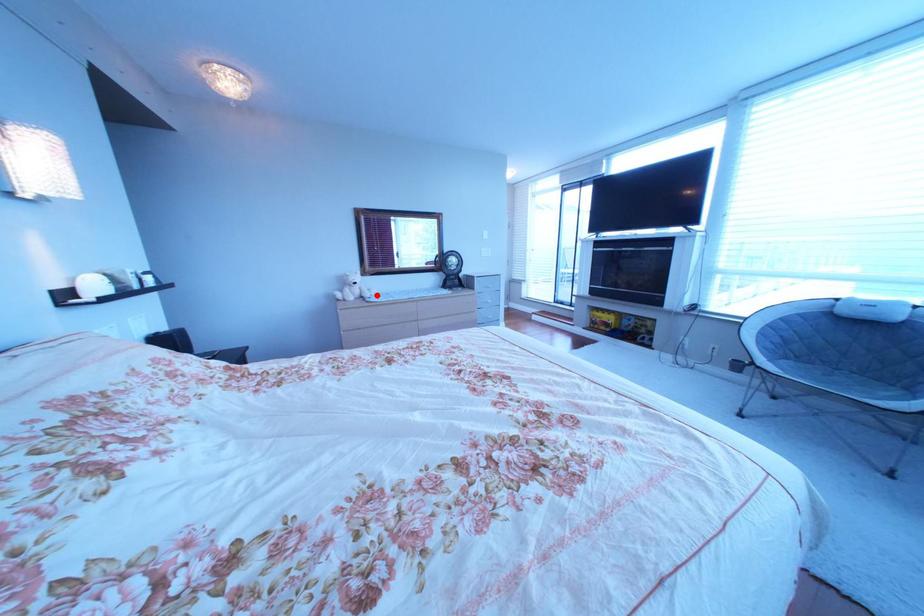
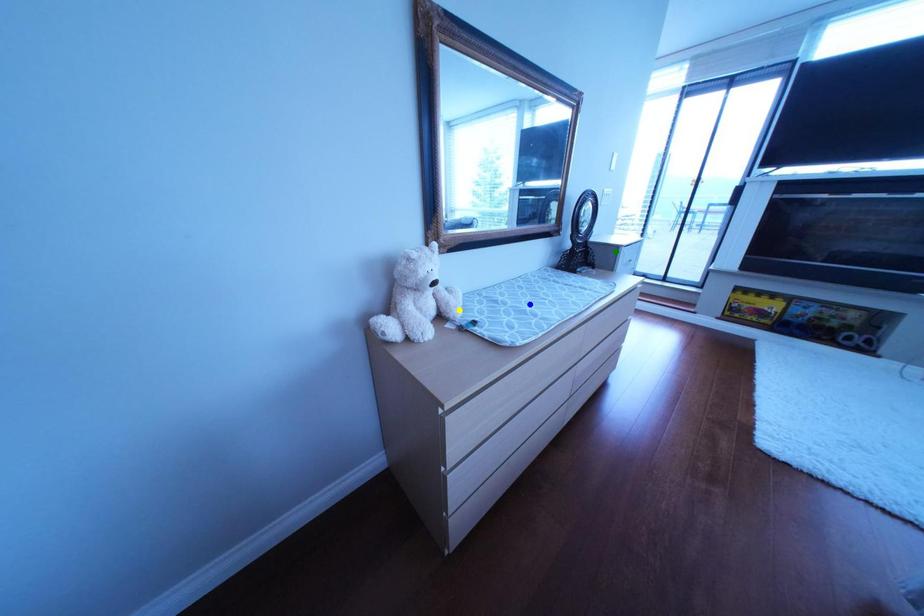
Question: I am providing you with two images of the same scene from different viewpoints. A red point is marked on the first image. You are given multiple points on the second image. Which spot in image 2 lines up with the point in image 1?

Choices:
 (A) yellow point
 (B) green point
 (C) blue point

Answer: (A)